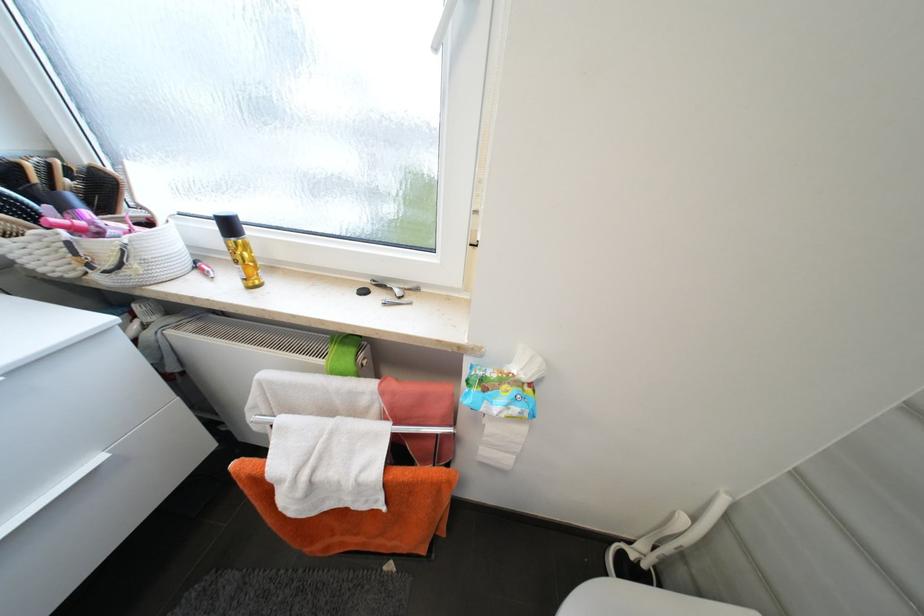
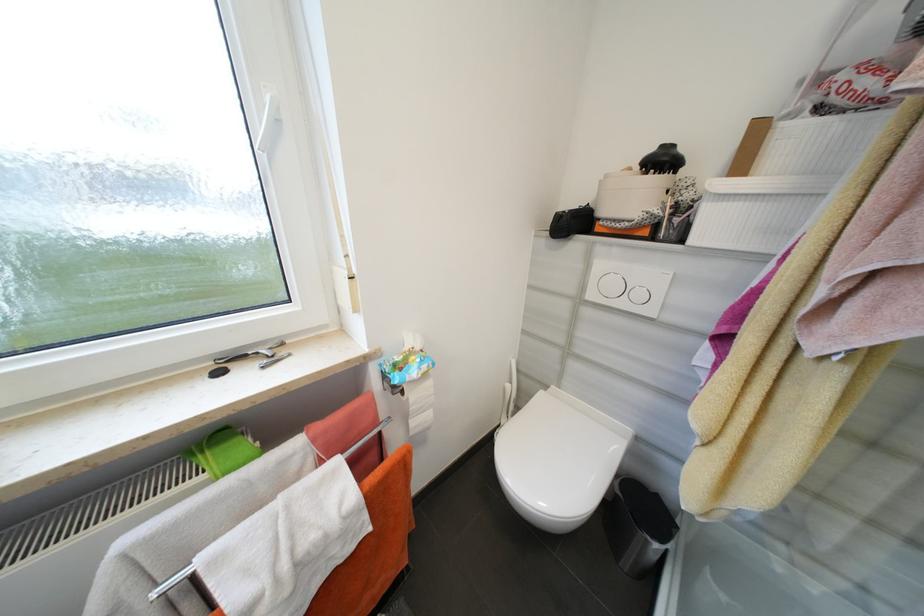
Locate, in the second image, the point that corresponds to the point at 689,519 in the first image.

(514, 387)